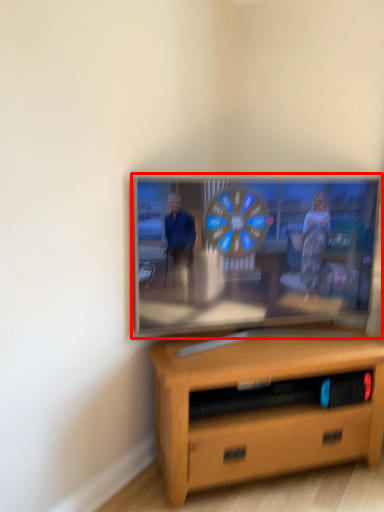
Question: From the image's perspective, what is the correct spatial positioning of television (annotated by the red box) in reference to desk?

Choices:
 (A) above
 (B) below

Answer: (A)